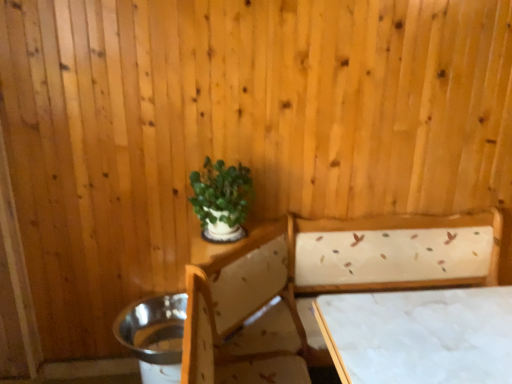
Question: Is point (454, 218) positioned closer to the camera than point (454, 357)?

Choices:
 (A) farther
 (B) closer

Answer: (A)

Question: In the image, is white fabric bed at center on the left side or the right side of white fabric-covered table at lower right?

Choices:
 (A) left
 (B) right

Answer: (A)

Question: Estimate the real-world distances between objects in this image. Which object is closer to the green matte plant at upper center?

Choices:
 (A) white fabric-covered table at lower right
 (B) white fabric bed at center

Answer: (B)

Question: Which of these objects is positioned closest to the green matte plant at upper center?

Choices:
 (A) white fabric-covered table at lower right
 (B) white fabric bed at center

Answer: (B)